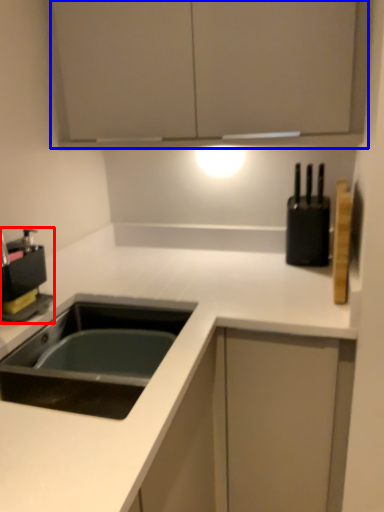
Question: Among these objects, which one is nearest to the camera, coffee machine (highlighted by a red box) or cabinetry (highlighted by a blue box)?

Choices:
 (A) coffee machine
 (B) cabinetry

Answer: (B)